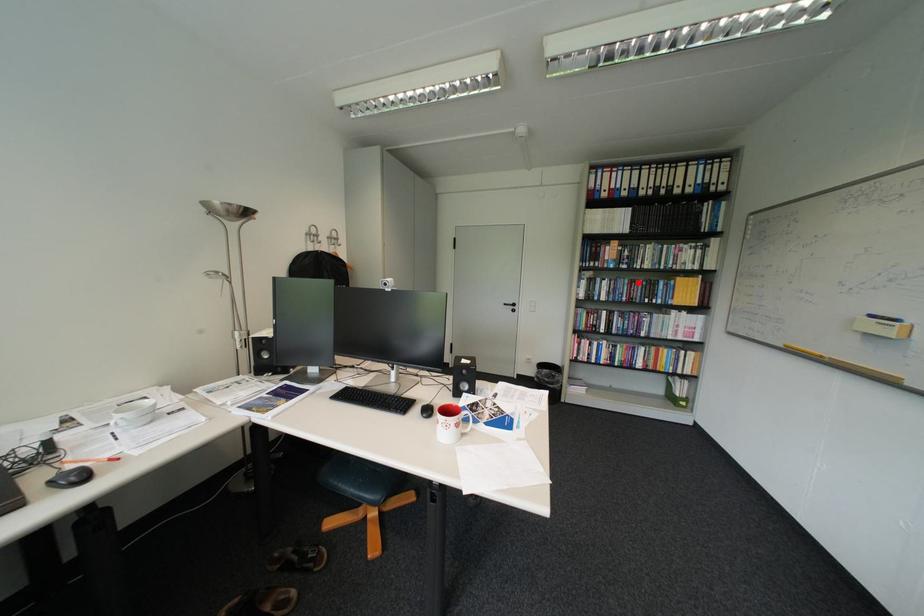
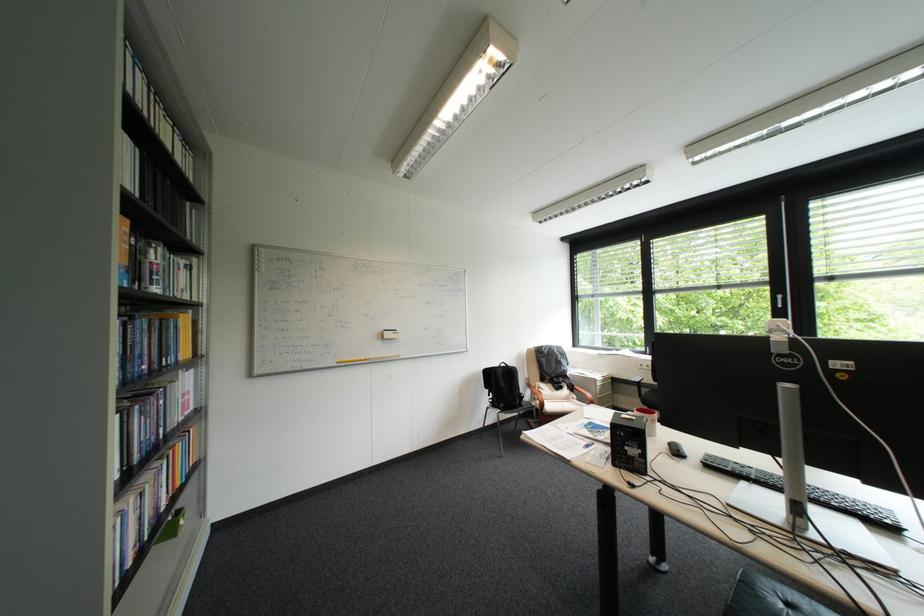
Find the pixel in the second image that matches the highlighted location in the first image.

(159, 326)